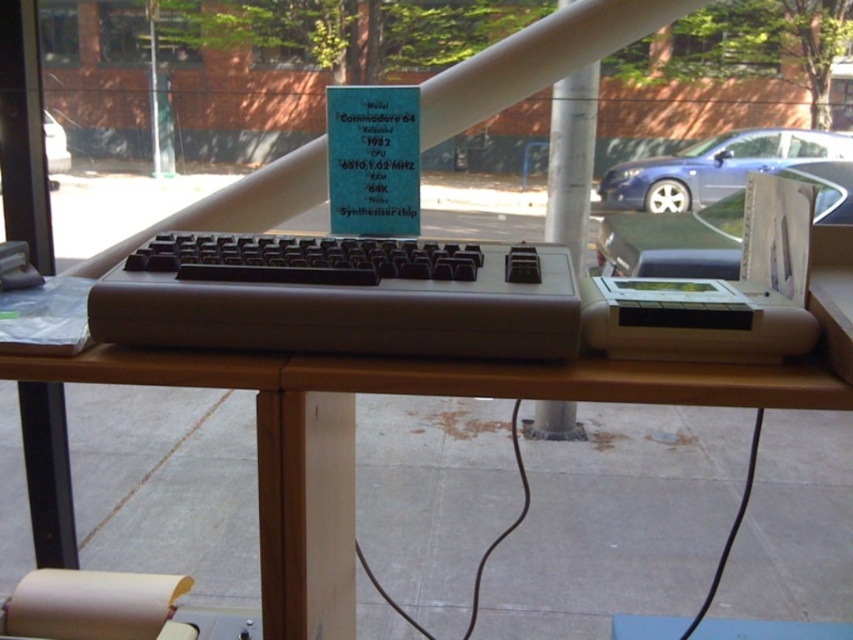
Does brown wood table at center have a smaller size compared to metallic blue car at left?

Actually, brown wood table at center might be larger than metallic blue car at left.

Image resolution: width=853 pixels, height=640 pixels. Identify the location of brown wood table at center. (354, 440).

You are a GUI agent. You are given a task and a screenshot of the screen. Output one action in this format:
    pyautogui.click(x=<x>, y=<y>)
    Task: Click on the brown wood table at center
    
    Given the screenshot: What is the action you would take?
    pyautogui.click(x=354, y=440)

Does metallic blue sedan at center have a larger size compared to white plastic pillar at center?

Correct, metallic blue sedan at center is larger in size than white plastic pillar at center.

Between point (790, 152) and point (585, 115), which one is positioned behind?

The point (790, 152) is behind.

Find the location of a particular element. metallic blue sedan at center is located at coordinates (714, 168).

Between brown wood table at center and matte black keyboard at center, which one appears on the right side from the viewer's perspective?

Positioned to the right is brown wood table at center.

What do you see at coordinates (354, 440) in the screenshot? I see `brown wood table at center` at bounding box center [354, 440].

Is point (370, 381) positioned in front of point (236, 336)?

Yes, point (370, 381) is in front of point (236, 336).

The width and height of the screenshot is (853, 640). In order to click on brown wood table at center in this screenshot , I will do `click(354, 440)`.